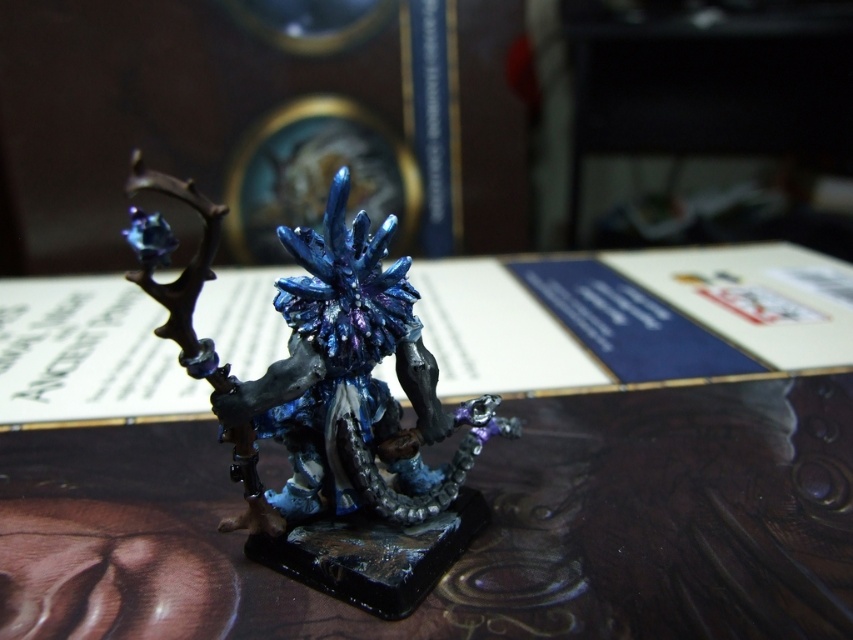
Question: Which point is farther from the camera taking this photo?

Choices:
 (A) (682, 413)
 (B) (381, 536)

Answer: (A)

Question: Does shiny brown table at center appear on the left side of shiny metallic figure at center?

Choices:
 (A) no
 (B) yes

Answer: (B)

Question: Does shiny brown table at center have a lesser width compared to shiny metallic figure at center?

Choices:
 (A) no
 (B) yes

Answer: (A)

Question: Is shiny brown table at center further to camera compared to shiny metallic figure at center?

Choices:
 (A) no
 (B) yes

Answer: (B)